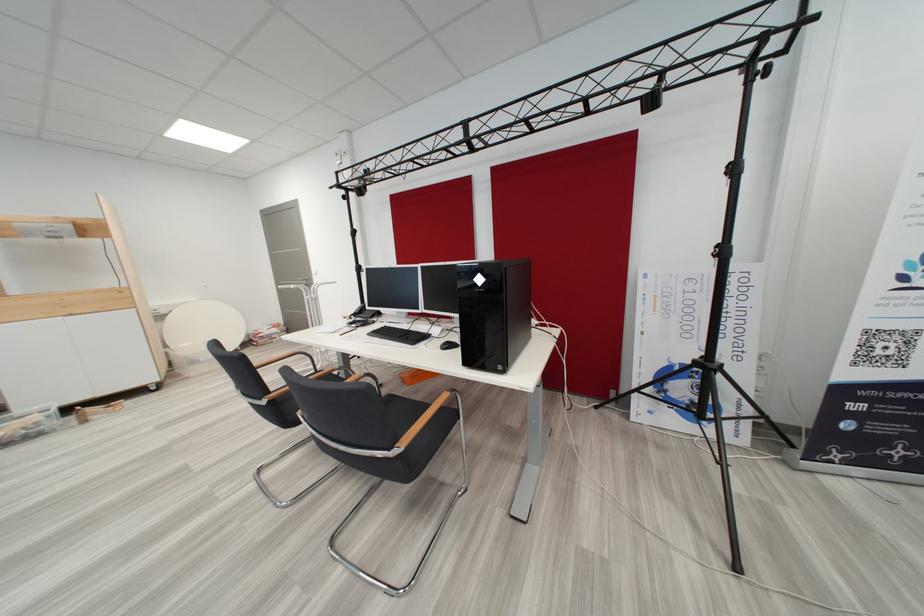
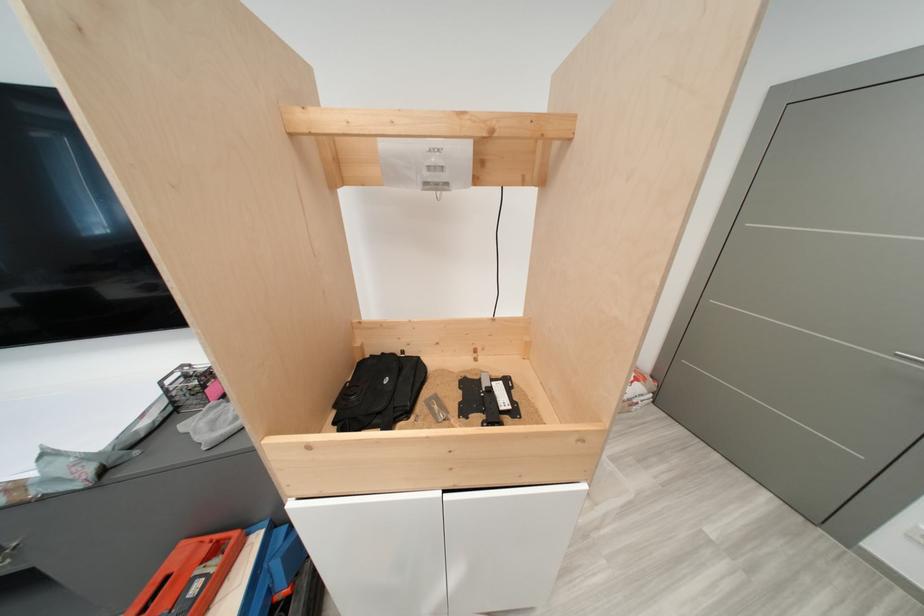
Where in the second image is the point corresponding to point 37,236 from the first image?

(405, 176)